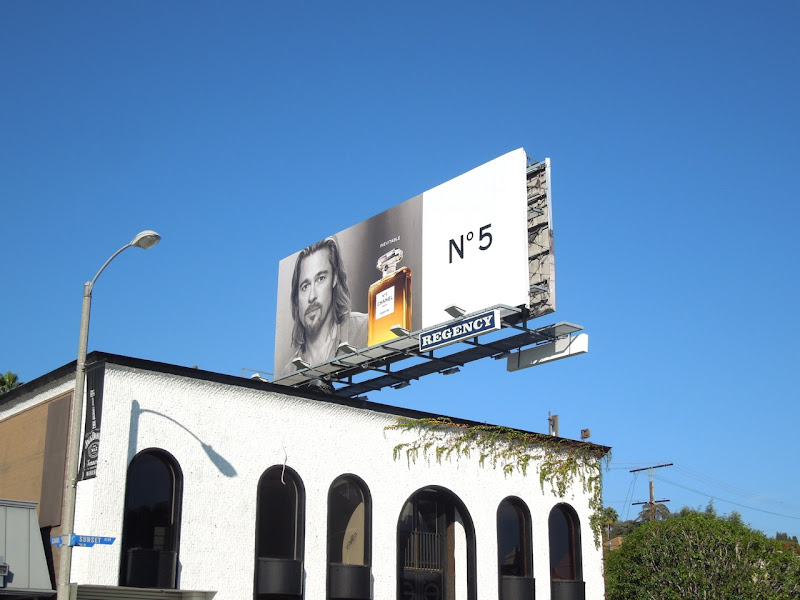
The height and width of the screenshot is (600, 800). Identify the location of arch windows. (568, 542), (509, 545), (357, 533), (282, 528), (154, 508).